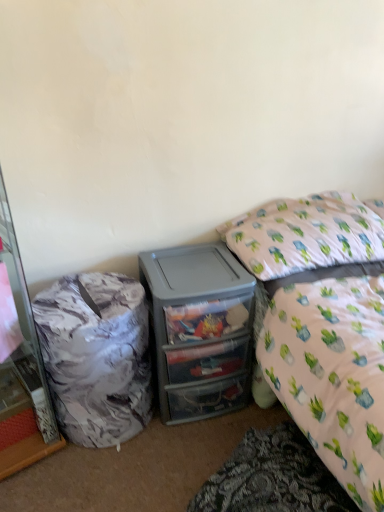
Find the location of a particular element. This screenshot has width=384, height=512. free space in front of marble-patterned trash can at left is located at coordinates (103, 479).